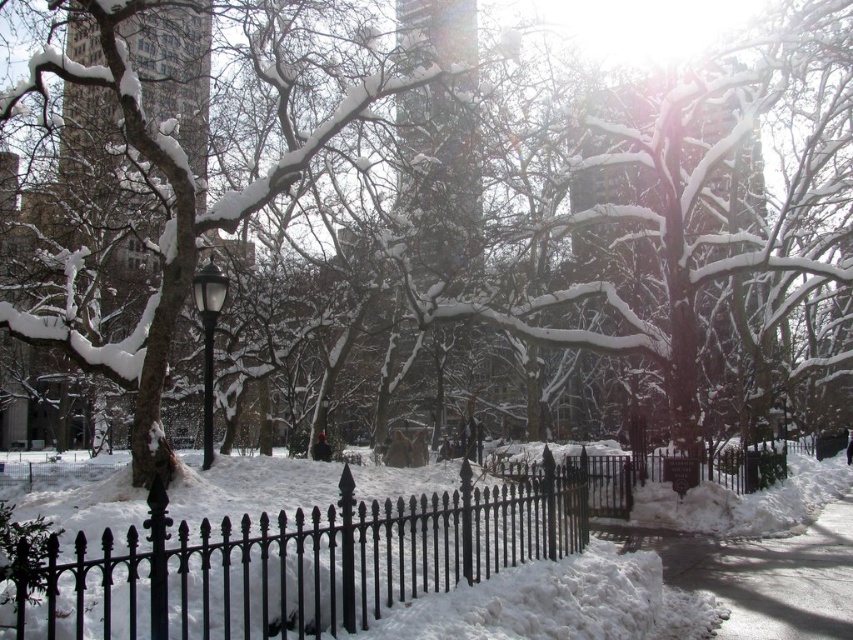
Question: Estimate the real-world distances between objects in this image. Which object is closer to the white snow at lower right?

Choices:
 (A) smooth glass tower at center
 (B) black matte lamp post at center-left
 (C) snow-covered tree at center
 (D) black wrought iron fence at center

Answer: (C)

Question: Among these points, which one is farthest from the camera?

Choices:
 (A) (222, 292)
 (B) (668, 545)
 (C) (474, 234)

Answer: (C)

Question: Considering the real-world distances, which object is farthest from the black wrought iron fence at center?

Choices:
 (A) white snow at lower right
 (B) black matte lamp post at center-left

Answer: (B)

Question: Is smooth glass tower at center further to camera compared to black matte lamp post at center-left?

Choices:
 (A) no
 (B) yes

Answer: (B)

Question: Can you confirm if snow-covered tree at center is positioned to the left of white snow at lower right?

Choices:
 (A) yes
 (B) no

Answer: (A)

Question: Is black wrought iron fence at center to the left of white snow at lower right from the viewer's perspective?

Choices:
 (A) no
 (B) yes

Answer: (B)